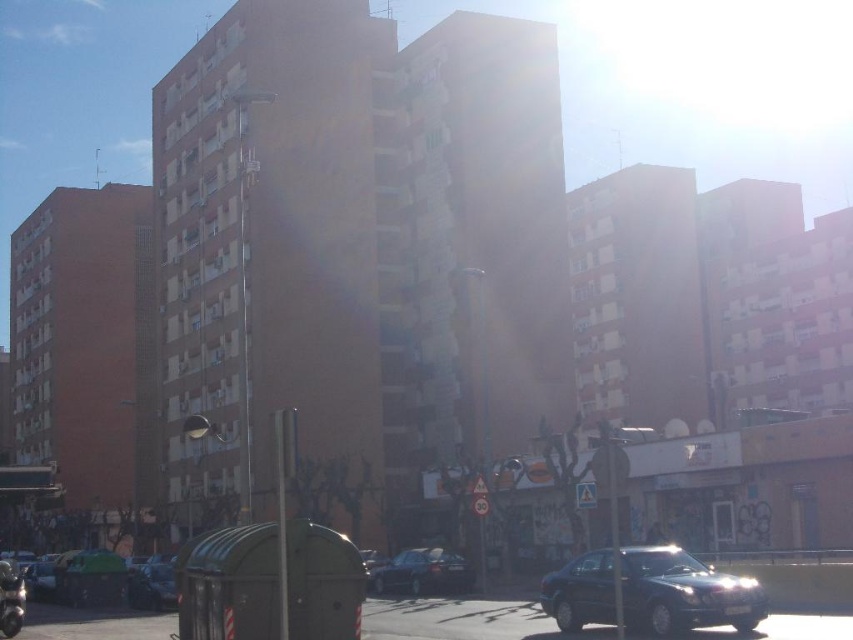
Question: Which object appears closest to the camera in this image?

Choices:
 (A) shiny dark blue sedan at center
 (B) shiny black car at lower left
 (C) green matte car at lower left

Answer: (A)

Question: Does shiny dark blue sedan at center appear on the right side of shiny black sedan at center?

Choices:
 (A) yes
 (B) no

Answer: (A)

Question: Can you confirm if shiny black sedan at center is smaller than shiny black car at lower left?

Choices:
 (A) yes
 (B) no

Answer: (A)

Question: Observing the image, what is the correct spatial positioning of shiny dark blue sedan at center in reference to shiny black car at lower left?

Choices:
 (A) right
 (B) left

Answer: (A)

Question: Which point appears closest to the camera in this image?

Choices:
 (A) (466, 568)
 (B) (142, 563)
 (C) (730, 592)
 (D) (169, 595)

Answer: (C)

Question: Among these objects, which one is nearest to the camera?

Choices:
 (A) shiny dark blue sedan at center
 (B) shiny black car at lower left
 (C) green matte car at lower left

Answer: (A)